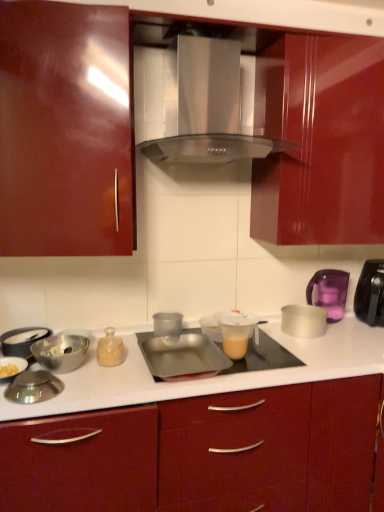
The height and width of the screenshot is (512, 384). I want to click on free space above shiny silver lid at lower left, positioned as the 6th appliance in right-to-left order (from a real-world perspective), so click(x=37, y=376).